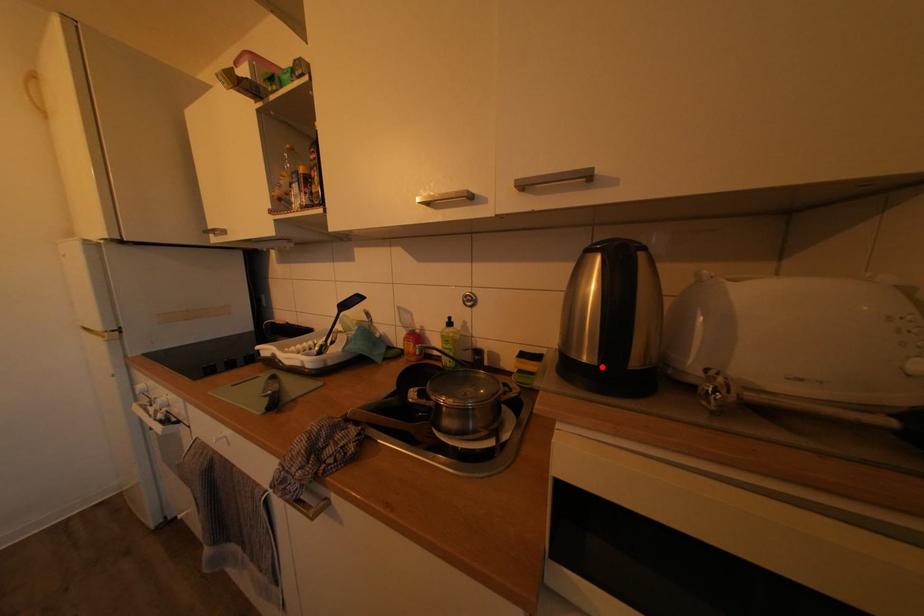
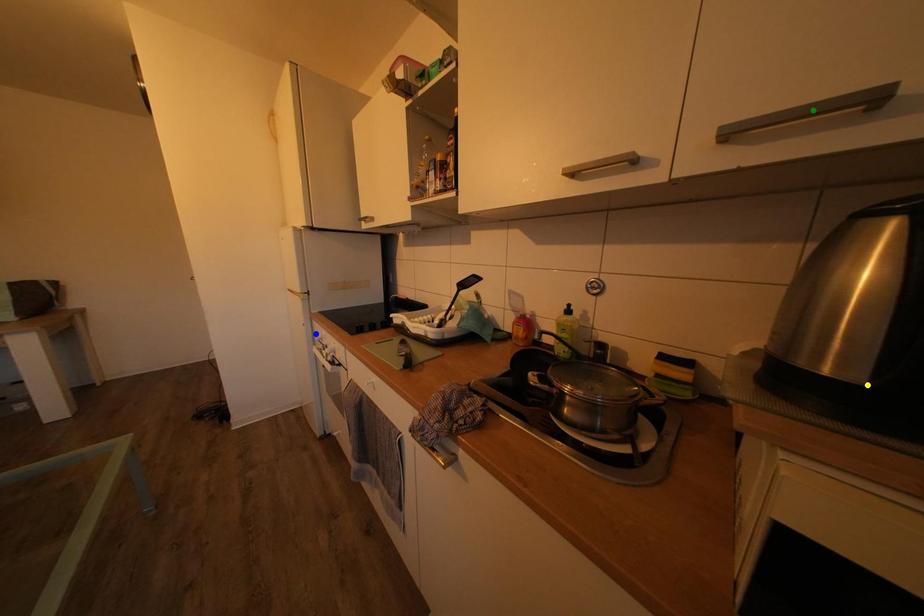
Question: I am providing you with two images of the same scene from different viewpoints. A red point is marked on the first image. You are given multiple points on the second image. Which point in image 2 represents the same 3d spot as the red point in image 1?

Choices:
 (A) blue point
 (B) yellow point
 (C) green point

Answer: (B)